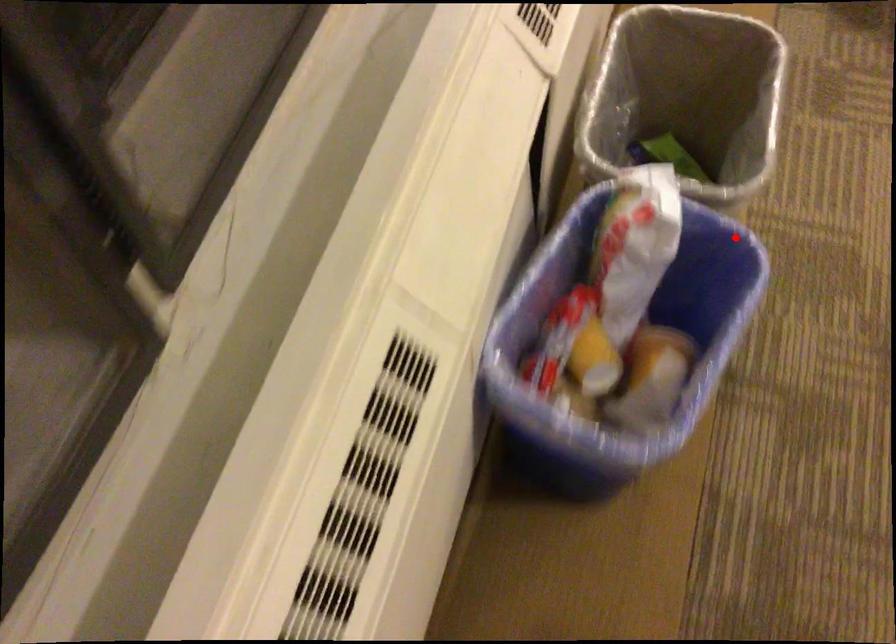
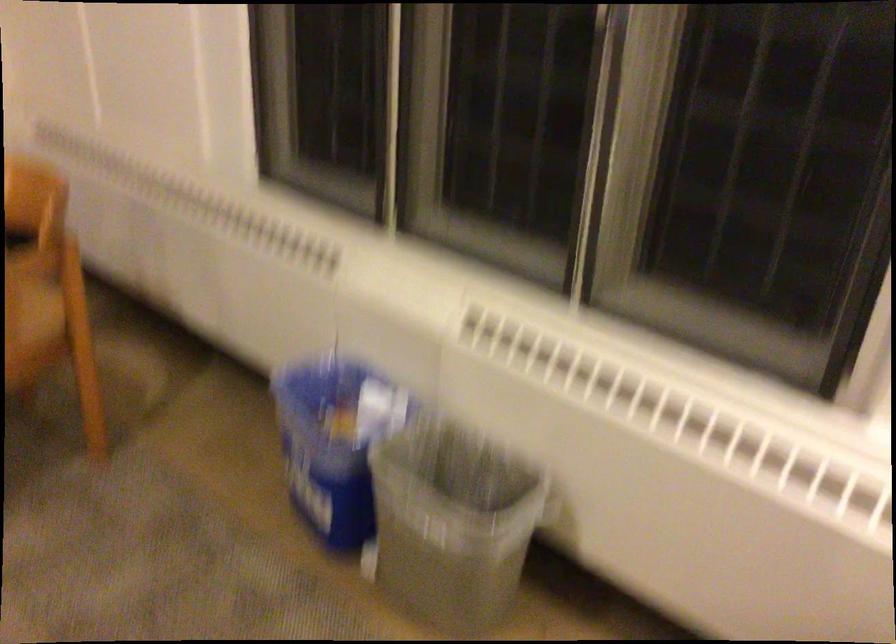
Where in the second image is the point corresponding to the highlighted location from the first image?

(334, 442)